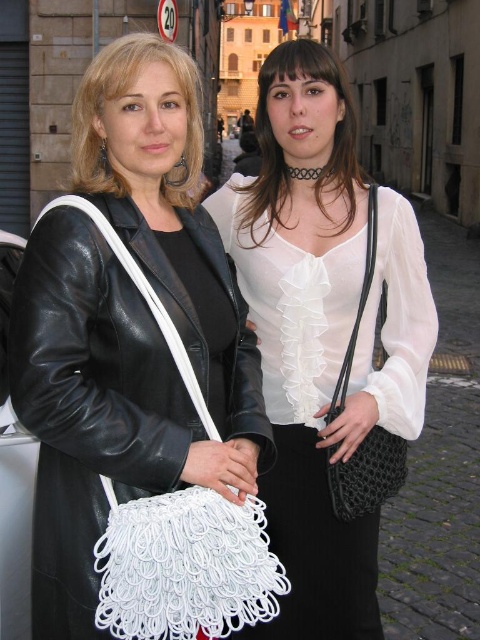
Question: Can you confirm if white woven bag at center is wider than white mesh bag at center?

Choices:
 (A) no
 (B) yes

Answer: (A)

Question: Can you confirm if white woven bag at center is positioned to the right of matte black jacket at center?

Choices:
 (A) yes
 (B) no

Answer: (A)

Question: Does matte black jacket at center appear on the left side of white sheer blouse at center?

Choices:
 (A) no
 (B) yes

Answer: (B)

Question: Which object appears closest to the camera in this image?

Choices:
 (A) matte black jacket at center
 (B) white woven bag at center

Answer: (B)

Question: Which point appears farthest from the camera in this image?

Choices:
 (A) (45, 532)
 (B) (373, 189)
 (C) (134, 38)
 (D) (348, 192)

Answer: (D)

Question: Which object appears closest to the camera in this image?

Choices:
 (A) matte black jacket at center
 (B) white woven bag at center
 (C) white sheer blouse at center

Answer: (B)